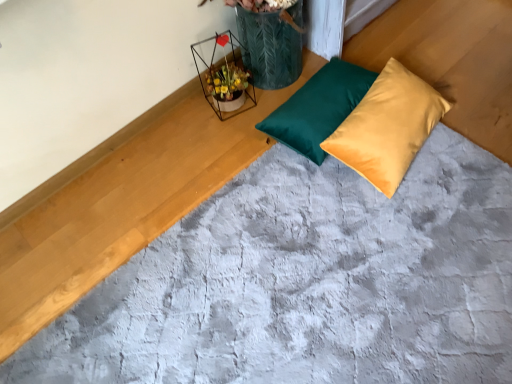
The width and height of the screenshot is (512, 384). I want to click on vacant space to the left of metallic wire flower basket at upper center, so click(189, 120).